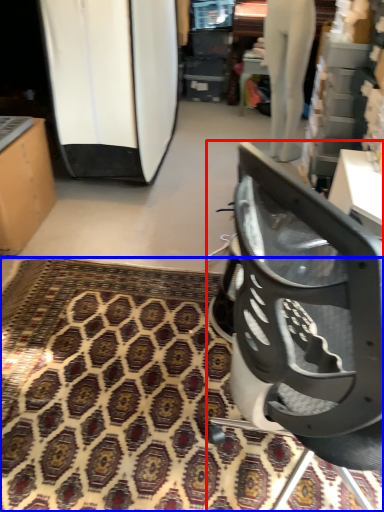
Question: Which point is closer to the camera, chair (highlighted by a red box) or mat (highlighted by a blue box)?

Choices:
 (A) chair
 (B) mat

Answer: (A)